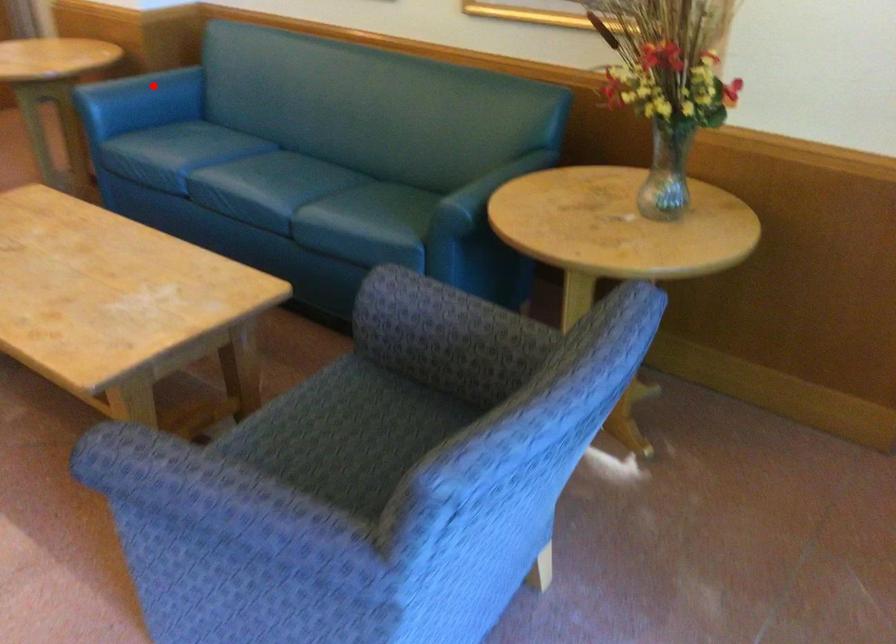
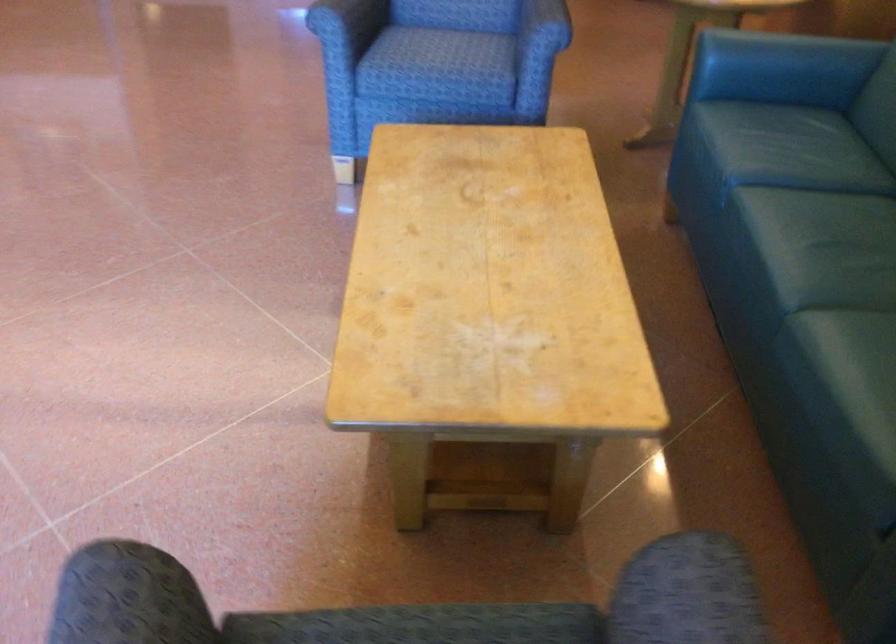
The point at the highlighted location is marked in the first image. Where is the corresponding point in the second image?

(785, 53)